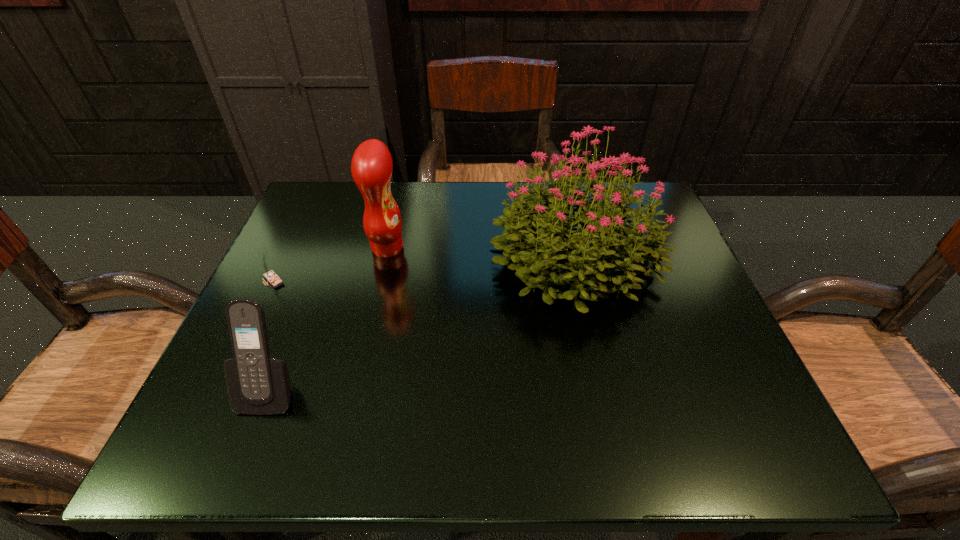
Image resolution: width=960 pixels, height=540 pixels. In order to click on vacant space at the far edge in this screenshot , I will do `click(441, 231)`.

In the image, there is a desktop. Where is `vacant area at the near edge`? The image size is (960, 540). vacant area at the near edge is located at coordinates (651, 440).

Locate an element on the screen. This screenshot has width=960, height=540. vacant space at the left edge is located at coordinates (x=298, y=385).

In the image, there is a desktop. In order to click on vacant space at the right edge in this screenshot , I will do `click(703, 295)`.

Find the location of a particular element. This screenshot has height=540, width=960. vacant space at the far left corner is located at coordinates (341, 218).

Image resolution: width=960 pixels, height=540 pixels. I want to click on free space at the near left corner, so click(x=194, y=430).

In the image, there is a desktop. Identify the location of free space at the near right corner. The width and height of the screenshot is (960, 540). (772, 440).

Identify the location of free space between the second object from right to left and the rightmost object. The width and height of the screenshot is (960, 540). pos(481,250).

Locate an element on the screen. vacant space that's between the cellular telephone and the bouquet is located at coordinates 422,321.

You are a GUI agent. You are given a task and a screenshot of the screen. Output one action in this format:
    pyautogui.click(x=<x>, y=<y>)
    Task: Click on the free space between the shortest object and the rightmost object
    
    Given the screenshot: What is the action you would take?
    pyautogui.click(x=424, y=267)